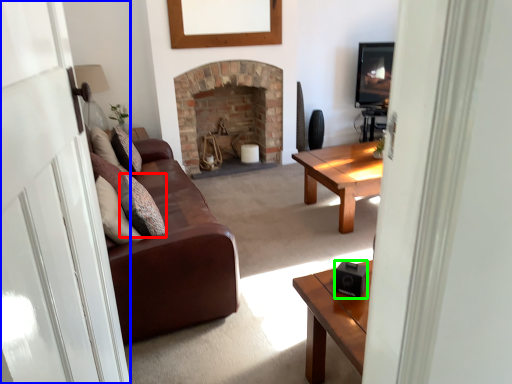
Question: Estimate the real-world distances between objects in this image. Which object is closer to pillow (highlighted by a red box), glass door (highlighted by a blue box) or speaker (highlighted by a green box)?

Choices:
 (A) glass door
 (B) speaker

Answer: (A)